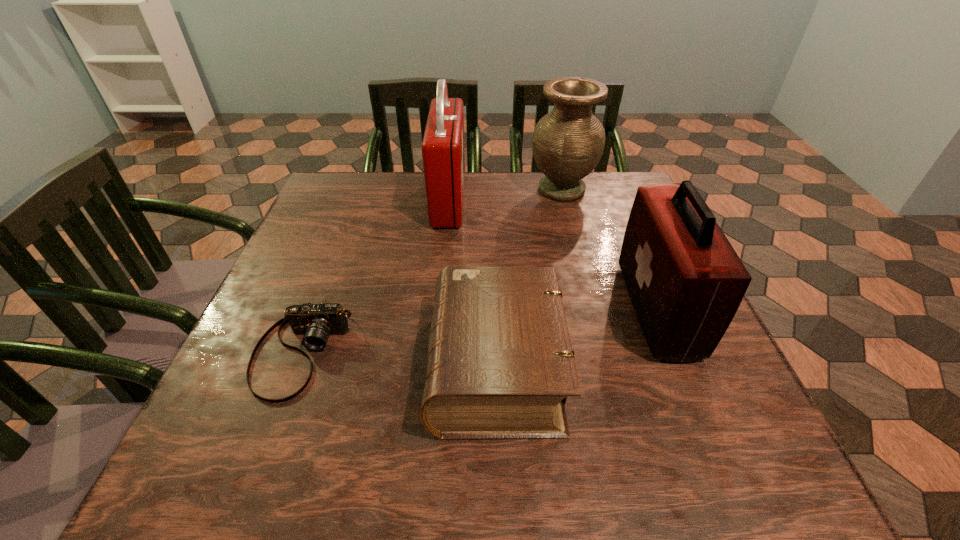
I want to click on the taller first aid kit, so click(443, 155).

The image size is (960, 540). Find the location of `the left first aid kit`. the left first aid kit is located at coordinates coord(443,155).

At what (x,y) coordinates should I click in order to perform the action: click on vase. Please return your answer as a coordinate pair (x, y). This screenshot has width=960, height=540. Looking at the image, I should click on pyautogui.click(x=568, y=142).

Find the location of `the right first aid kit`. the right first aid kit is located at coordinates (685, 280).

Identify the location of the nearer first aid kit. This screenshot has width=960, height=540. (685, 280).

Identify the location of the second shortest object. The width and height of the screenshot is (960, 540). click(x=500, y=365).

Locate an element on the screen. This screenshot has width=960, height=540. the shortest object is located at coordinates (316, 322).

Identify the location of camera. (316, 322).

Identify the location of free space located 0.320m on the front face of the left first aid kit. The image size is (960, 540). click(x=586, y=200).

The height and width of the screenshot is (540, 960). I want to click on vacant point located 0.170m on the left of the vase, so click(x=466, y=190).